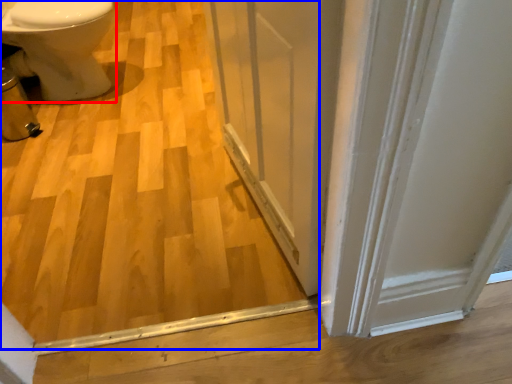
Question: Which object is closer to the camera taking this photo, bidet (highlighted by a red box) or plywood (highlighted by a blue box)?

Choices:
 (A) bidet
 (B) plywood

Answer: (B)